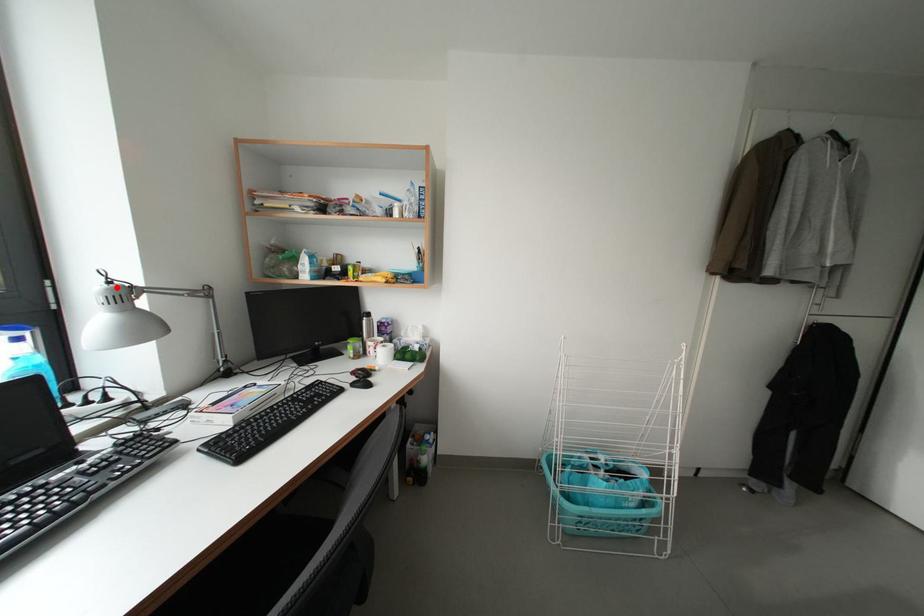
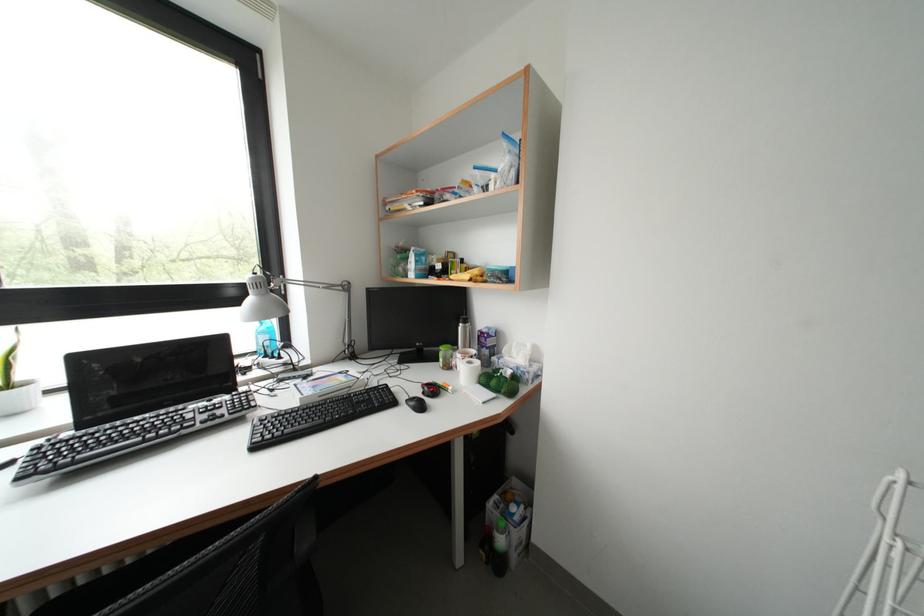
Question: I am providing you with two images of the same scene from different viewpoints. A red point is marked on the first image. At the location where the point appears in image 1, is it still visible in image 2?

Choices:
 (A) Yes
 (B) No

Answer: (A)